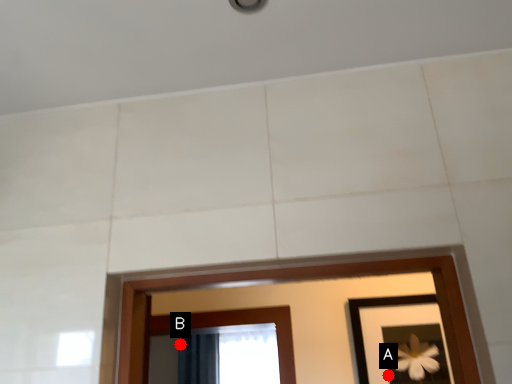
Question: Two points are circled on the image, labeled by A and B beside each circle. Which point appears closest to the camera in this image?

Choices:
 (A) A is closer
 (B) B is closer

Answer: (A)